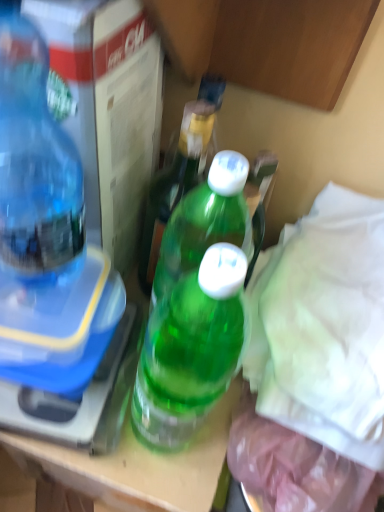
Question: Is green plastic bottle at center, which appears as the 1th bottle when viewed from the right, not close to transparent plastic bottle at left, placed as the 2th bottle when sorted from right to left?

Choices:
 (A) no
 (B) yes

Answer: (A)

Question: Does green plastic bottle at center, which is counted as the 2th bottle, starting from the left, appear on the right side of transparent plastic bottle at left, marked as the 1th bottle in a left-to-right arrangement?

Choices:
 (A) no
 (B) yes

Answer: (B)

Question: Does green plastic bottle at center, which is counted as the 2th bottle, starting from the left, have a lesser width compared to transparent plastic bottle at left, placed as the 2th bottle when sorted from right to left?

Choices:
 (A) no
 (B) yes

Answer: (B)

Question: Considering the relative sizes of green plastic bottle at center, which is counted as the 2th bottle, starting from the left, and transparent plastic bottle at left, placed as the 2th bottle when sorted from right to left, in the image provided, is green plastic bottle at center, which is counted as the 2th bottle, starting from the left, smaller than transparent plastic bottle at left, placed as the 2th bottle when sorted from right to left,?

Choices:
 (A) yes
 (B) no

Answer: (A)

Question: Is green plastic bottle at center, which is counted as the 2th bottle, starting from the left, surrounding transparent plastic bottle at left, marked as the 1th bottle in a left-to-right arrangement?

Choices:
 (A) no
 (B) yes

Answer: (A)

Question: Considering the relative sizes of green plastic bottle at center, which appears as the 1th bottle when viewed from the right, and transparent plastic bottle at left, marked as the 1th bottle in a left-to-right arrangement, in the image provided, is green plastic bottle at center, which appears as the 1th bottle when viewed from the right, bigger than transparent plastic bottle at left, marked as the 1th bottle in a left-to-right arrangement,?

Choices:
 (A) no
 (B) yes

Answer: (A)

Question: Is transparent plastic bottle at left, marked as the 1th bottle in a left-to-right arrangement, touching green plastic bottle at center, which is counted as the 2th bottle, starting from the left?

Choices:
 (A) no
 (B) yes

Answer: (A)

Question: Is transparent plastic bottle at left, marked as the 1th bottle in a left-to-right arrangement, far from green plastic bottle at center, which is counted as the 2th bottle, starting from the left?

Choices:
 (A) no
 (B) yes

Answer: (A)

Question: Can you confirm if transparent plastic bottle at left, placed as the 2th bottle when sorted from right to left, is bigger than green plastic bottle at center, which is counted as the 2th bottle, starting from the left?

Choices:
 (A) yes
 (B) no

Answer: (A)

Question: From the image's perspective, would you say transparent plastic bottle at left, placed as the 2th bottle when sorted from right to left, is shown under green plastic bottle at center, which appears as the 1th bottle when viewed from the right?

Choices:
 (A) no
 (B) yes

Answer: (A)

Question: Is transparent plastic bottle at left, marked as the 1th bottle in a left-to-right arrangement, facing away from green plastic bottle at center, which appears as the 1th bottle when viewed from the right?

Choices:
 (A) yes
 (B) no

Answer: (B)

Question: From a real-world perspective, is transparent plastic bottle at left, marked as the 1th bottle in a left-to-right arrangement, beneath green plastic bottle at center, which appears as the 1th bottle when viewed from the right?

Choices:
 (A) yes
 (B) no

Answer: (B)

Question: Is point coord(140,285) closer or farther from the camera than point coord(38,254)?

Choices:
 (A) closer
 (B) farther

Answer: (B)